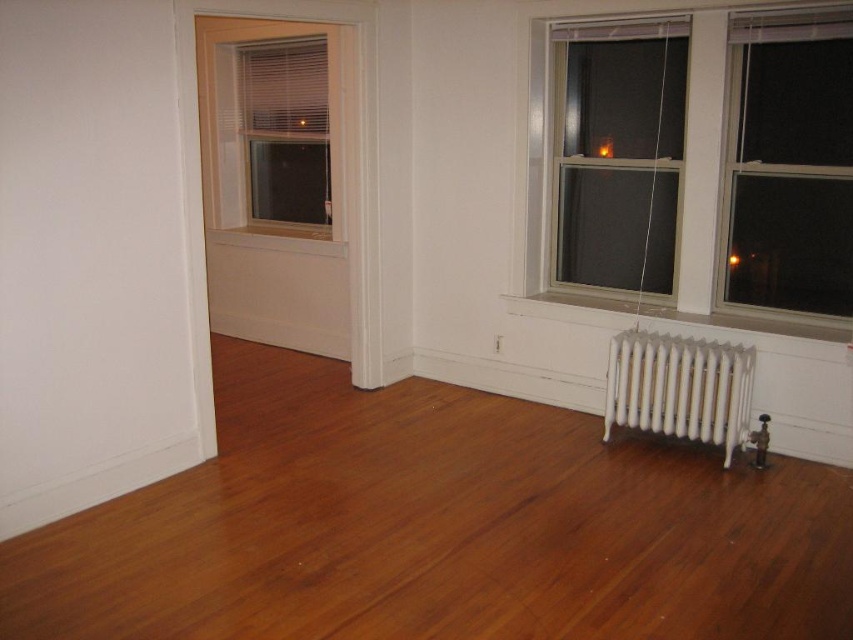
Question: Which point appears closest to the camera in this image?

Choices:
 (A) (729, 358)
 (B) (596, 51)

Answer: (A)

Question: Is transparent glass window at upper right smaller than white metallic radiator at lower right?

Choices:
 (A) yes
 (B) no

Answer: (B)

Question: Which point is farther to the camera?

Choices:
 (A) (36, 561)
 (B) (796, 269)

Answer: (B)

Question: Is transparent glass window at upper right bigger than white metallic radiator at lower right?

Choices:
 (A) no
 (B) yes

Answer: (B)

Question: Based on their relative distances, which object is farther from the white wood window at upper left?

Choices:
 (A) transparent glass window at upper right
 (B) white metallic radiator at lower right

Answer: (B)

Question: Is transparent glass window at upper right to the right of white wood window at upper left from the viewer's perspective?

Choices:
 (A) yes
 (B) no

Answer: (A)